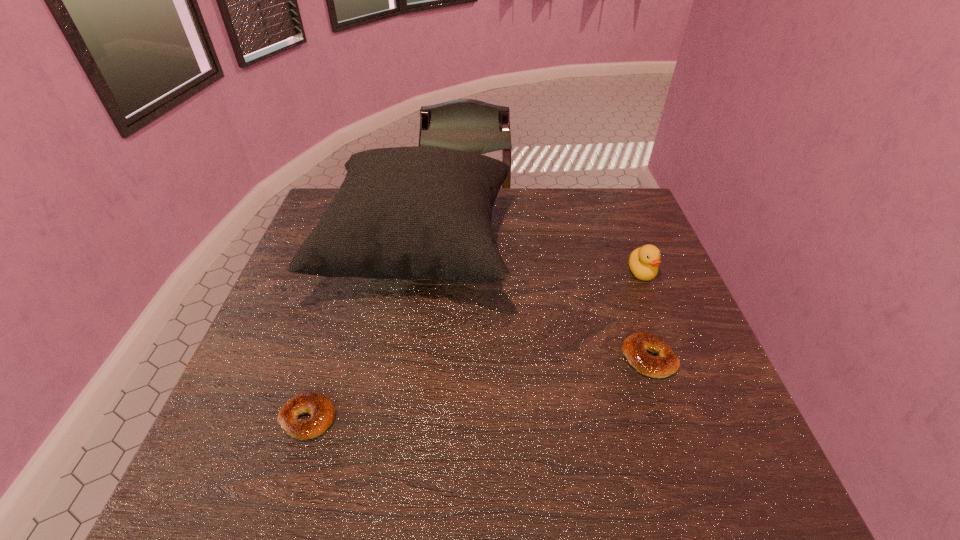
Identify the location of object that is at the far edge. The image size is (960, 540). (408, 213).

At what (x,y) coordinates should I click in order to perform the action: click on cushion present at the left edge. Please return your answer as a coordinate pair (x, y). The height and width of the screenshot is (540, 960). Looking at the image, I should click on (408, 213).

Locate an element on the screen. bagel that is at the left edge is located at coordinates (316, 404).

This screenshot has width=960, height=540. I want to click on duck that is at the right edge, so click(x=643, y=262).

What are the coordinates of `bagel at the right edge` in the screenshot? It's located at (635, 346).

This screenshot has width=960, height=540. In order to click on object at the far left corner in this screenshot , I will do `click(408, 213)`.

In the image, there is a desktop. At what (x,y) coordinates should I click in order to perform the action: click on free region at the far edge. Please return your answer as a coordinate pair (x, y). The image size is (960, 540). Looking at the image, I should click on (535, 212).

Where is `free space at the near edge of the desktop`? Image resolution: width=960 pixels, height=540 pixels. free space at the near edge of the desktop is located at coordinates (575, 490).

Find the location of a particular element. This screenshot has width=960, height=540. vacant space at the left edge of the desktop is located at coordinates (292, 280).

In order to click on vacant point at the right edge in this screenshot , I will do `click(633, 310)`.